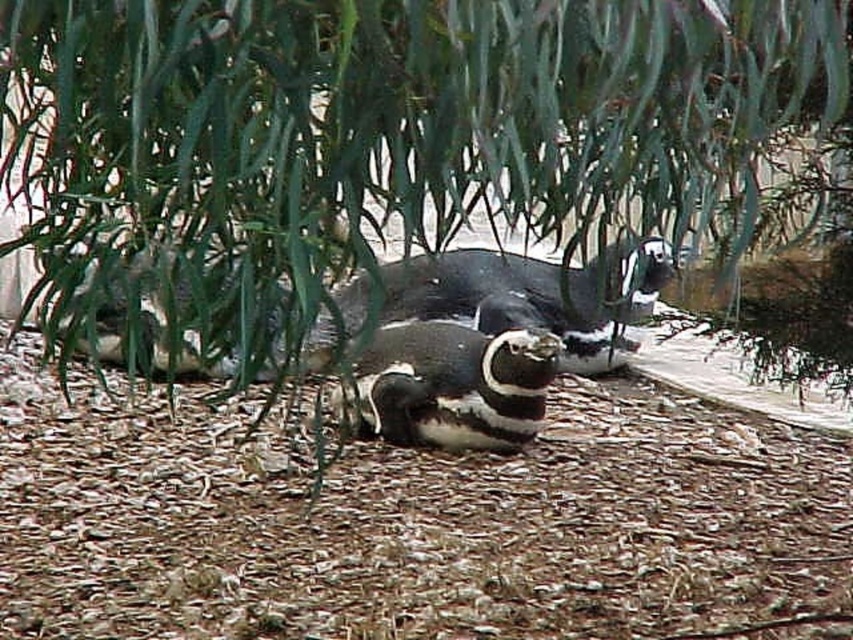
Question: Does black matte penguin at center appear under black and white penguin at center?

Choices:
 (A) no
 (B) yes

Answer: (A)

Question: Which object is closer to the camera taking this photo?

Choices:
 (A) green leafy tree at center
 (B) black and white penguin at center

Answer: (A)

Question: Is green leafy tree at center in front of black and white penguin at center?

Choices:
 (A) yes
 (B) no

Answer: (A)

Question: Which object appears farthest from the camera in this image?

Choices:
 (A) green leafy tree at center
 (B) black matte penguin at center
 (C) black and white penguin at center

Answer: (B)

Question: Estimate the real-world distances between objects in this image. Which object is closer to the black and white penguin at center?

Choices:
 (A) green leafy tree at center
 (B) black matte penguin at center

Answer: (B)

Question: Considering the relative positions of green leafy tree at center and black and white penguin at center in the image provided, where is green leafy tree at center located with respect to black and white penguin at center?

Choices:
 (A) above
 (B) below

Answer: (A)